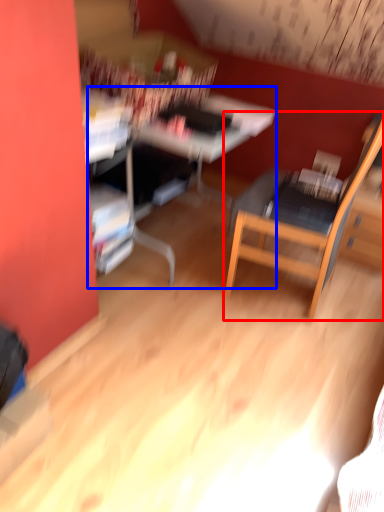
Question: Which of the following is the farthest to the observer, chair (highlighted by a red box) or computer desk (highlighted by a blue box)?

Choices:
 (A) chair
 (B) computer desk

Answer: (B)